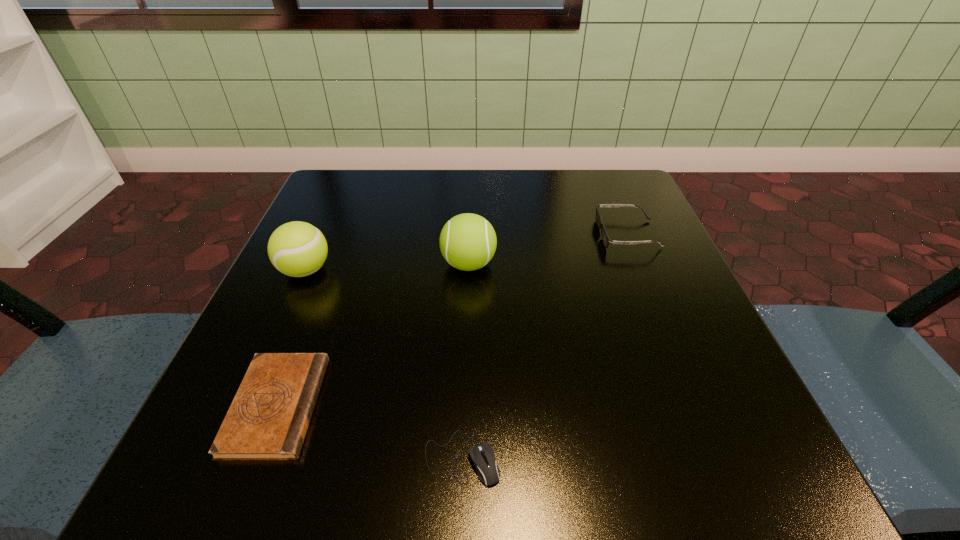
Where is `object that is at the far right corner`? The width and height of the screenshot is (960, 540). object that is at the far right corner is located at coordinates (606, 240).

Find the location of a particular element. This screenshot has height=540, width=960. blank space at the far edge of the desktop is located at coordinates (497, 175).

In the image, there is a desktop. Identify the location of vacant area at the near edge. (578, 485).

The image size is (960, 540). Identify the location of blank space at the left edge. (273, 325).

The height and width of the screenshot is (540, 960). I want to click on free point at the right edge, so click(x=629, y=299).

Image resolution: width=960 pixels, height=540 pixels. I want to click on vacant space at the far left corner of the desktop, so click(x=355, y=199).

Image resolution: width=960 pixels, height=540 pixels. I want to click on free point at the near left corner, so click(x=203, y=437).

You are a GUI agent. You are given a task and a screenshot of the screen. Output one action in this format:
    pyautogui.click(x=<x>, y=<y>)
    Task: Click on the vacant space at the far right corner of the desktop
    The width and height of the screenshot is (960, 540).
    Given the screenshot: What is the action you would take?
    pyautogui.click(x=576, y=191)

The image size is (960, 540). Identify the location of free space between the computer mouse and the left tennis ball. (384, 364).

The height and width of the screenshot is (540, 960). Find the location of `unoccupied position between the diary and the left tennis ball`. unoccupied position between the diary and the left tennis ball is located at coordinates (291, 338).